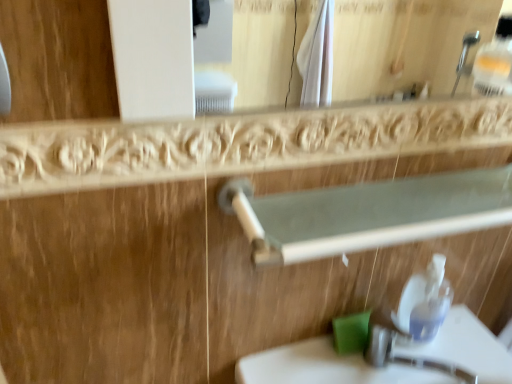
Question: Is white glossy sink at lower center closer to the viewer compared to green matte soap at lower center?

Choices:
 (A) yes
 (B) no

Answer: (A)

Question: Considering the relative sizes of white glossy sink at lower center and green matte soap at lower center in the image provided, is white glossy sink at lower center smaller than green matte soap at lower center?

Choices:
 (A) yes
 (B) no

Answer: (B)

Question: Considering the relative positions of white glossy sink at lower center and green matte soap at lower center in the image provided, is white glossy sink at lower center behind green matte soap at lower center?

Choices:
 (A) no
 (B) yes

Answer: (A)

Question: Is white glossy sink at lower center taller than green matte soap at lower center?

Choices:
 (A) no
 (B) yes

Answer: (B)

Question: Does white glossy sink at lower center have a greater width compared to green matte soap at lower center?

Choices:
 (A) yes
 (B) no

Answer: (A)

Question: Does point (440, 274) appear closer or farther from the camera than point (286, 220)?

Choices:
 (A) farther
 (B) closer

Answer: (A)

Question: From a real-world perspective, is transparent plastic soap dispenser at lower right physically located above or below white plastic rail at upper center?

Choices:
 (A) below
 (B) above

Answer: (A)

Question: Is transparent plastic soap dispenser at lower right taller or shorter than white plastic rail at upper center?

Choices:
 (A) short
 (B) tall

Answer: (B)

Question: Visually, is transparent plastic soap dispenser at lower right positioned to the left or to the right of white plastic rail at upper center?

Choices:
 (A) right
 (B) left

Answer: (A)

Question: From a real-world perspective, relative to white glossy sink at lower center, is green matte soap at lower center vertically above or below?

Choices:
 (A) below
 (B) above

Answer: (B)

Question: From the image's perspective, is green matte soap at lower center above or below white glossy sink at lower center?

Choices:
 (A) above
 (B) below

Answer: (A)

Question: Is green matte soap at lower center inside or outside of white glossy sink at lower center?

Choices:
 (A) inside
 (B) outside

Answer: (B)

Question: Relative to white glossy sink at lower center, is green matte soap at lower center in front or behind?

Choices:
 (A) behind
 (B) front

Answer: (A)

Question: Is transparent plastic soap dispenser at lower right bigger or smaller than green matte soap at lower center?

Choices:
 (A) big
 (B) small

Answer: (A)

Question: From a real-world perspective, is transparent plastic soap dispenser at lower right positioned above or below green matte soap at lower center?

Choices:
 (A) above
 (B) below

Answer: (A)